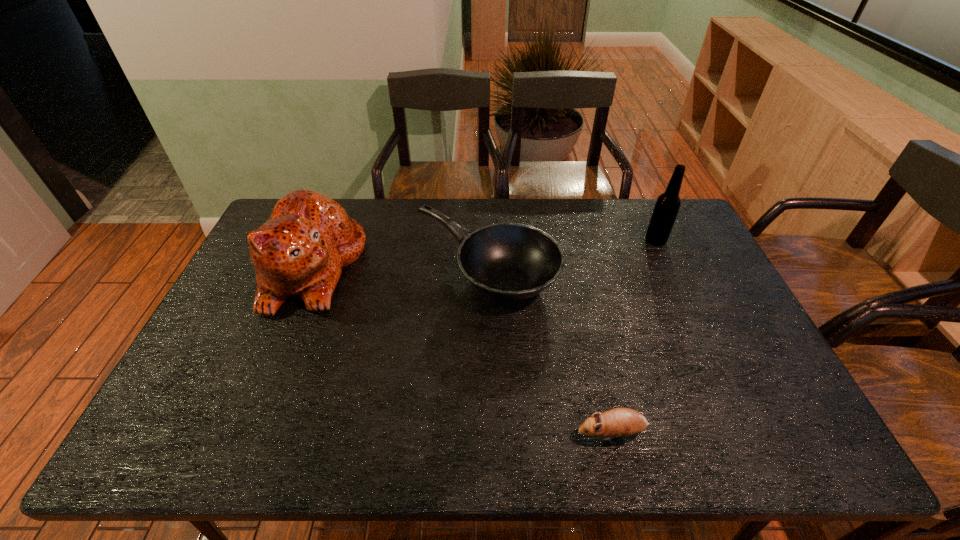
The image size is (960, 540). In the image, there is a desktop. What are the coordinates of `free space at the near edge` in the screenshot? It's located at (229, 429).

Locate an element on the screen. The height and width of the screenshot is (540, 960). vacant space at the left edge is located at coordinates (239, 285).

You are a GUI agent. You are given a task and a screenshot of the screen. Output one action in this format:
    pyautogui.click(x=<x>, y=<y>)
    Task: Click on the free location at the right edge
    The width and height of the screenshot is (960, 540).
    Given the screenshot: What is the action you would take?
    pyautogui.click(x=761, y=356)

The image size is (960, 540). I want to click on empty location between the hamster and the rightmost object, so click(x=634, y=336).

The width and height of the screenshot is (960, 540). What are the coordinates of `free spot between the third tallest object and the nearest object` in the screenshot? It's located at (549, 352).

The width and height of the screenshot is (960, 540). Find the location of `free space between the frying pan and the shortest object`. free space between the frying pan and the shortest object is located at coordinates (549, 352).

At what (x,y) coordinates should I click in order to perform the action: click on free spot between the cat and the second shortest object. Please return your answer as a coordinate pair (x, y). Looking at the image, I should click on (399, 269).

The image size is (960, 540). Identify the location of unoccupied area between the second shortest object and the rightmost object. (571, 255).

Image resolution: width=960 pixels, height=540 pixels. What are the coordinates of `vacant area that lies between the third tallest object and the nearest object` in the screenshot? It's located at 549,352.

Locate an element on the screen. The image size is (960, 540). free space between the shortest object and the frying pan is located at coordinates (549, 352).